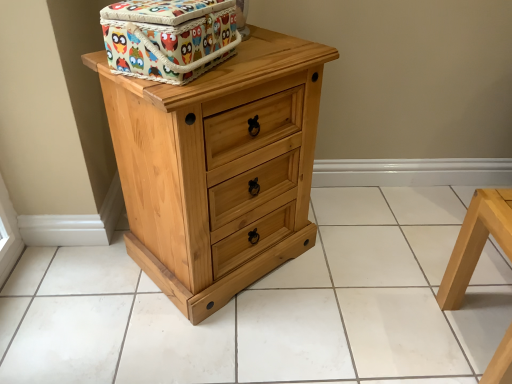
The height and width of the screenshot is (384, 512). I want to click on vacant area that lies between natural wood chest of drawers at center and light wood stool at lower right, so click(356, 305).